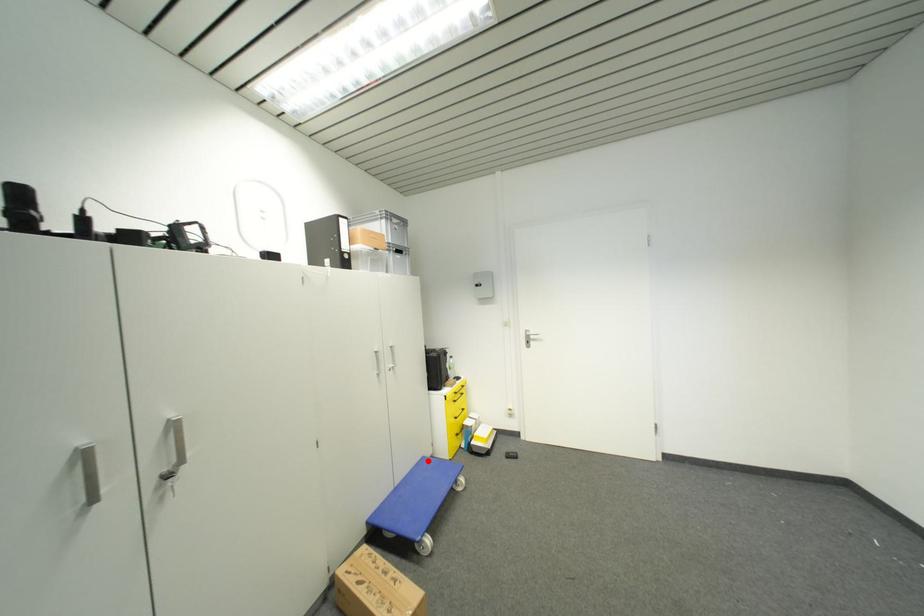
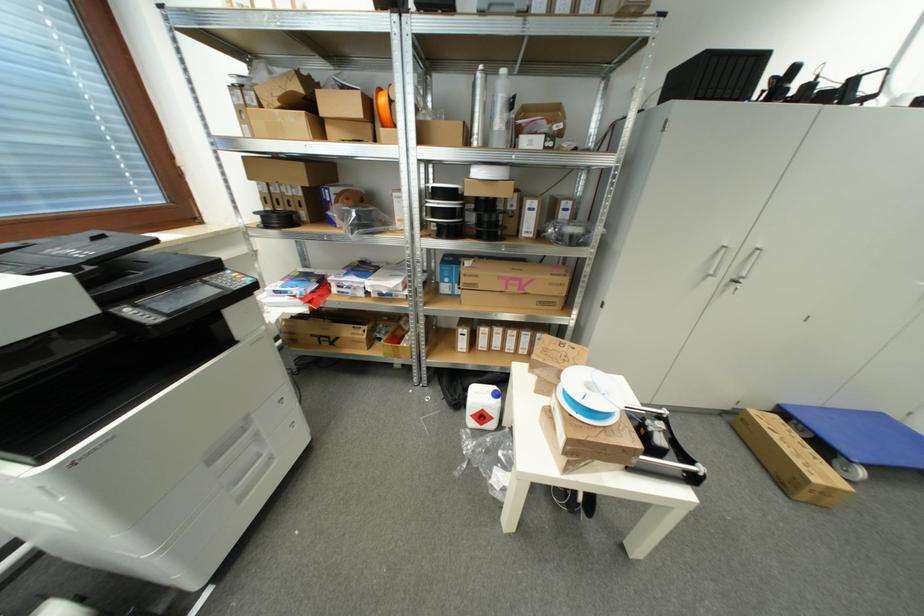
Find the pixel in the second image that matches the highlighted location in the first image.

(885, 418)